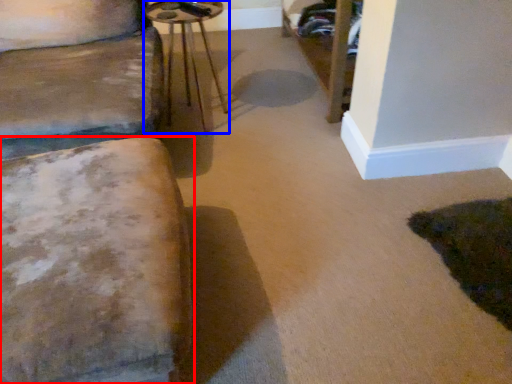
Question: Which object appears closest to the camera in this image, furniture (highlighted by a red box) or side table (highlighted by a blue box)?

Choices:
 (A) furniture
 (B) side table

Answer: (A)